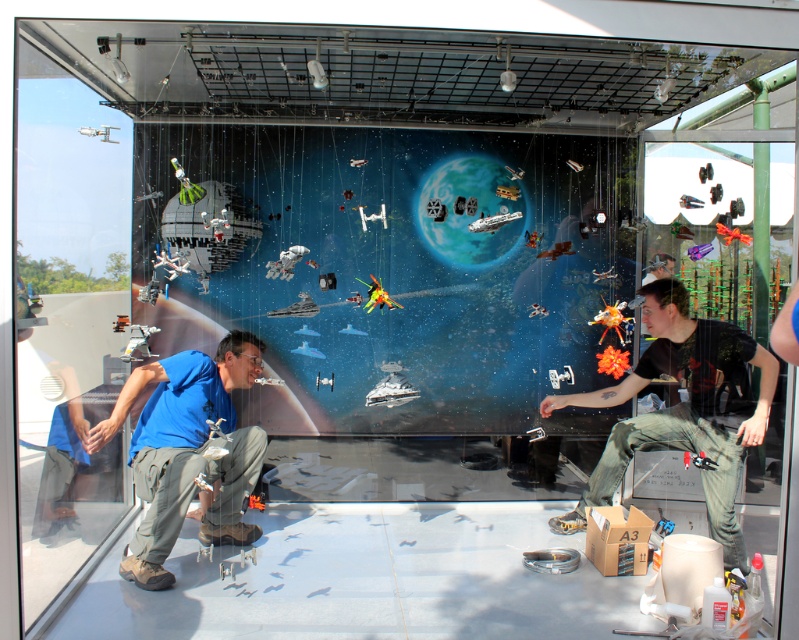
Question: Is transparent glass door at upper left thinner than blue fabric shirt at lower left?

Choices:
 (A) no
 (B) yes

Answer: (B)

Question: Does transparent glass door at upper left have a greater width compared to blue fabric shirt at lower left?

Choices:
 (A) no
 (B) yes

Answer: (A)

Question: Which of the following is the farthest from the observer?

Choices:
 (A) blue fabric shirt at lower left
 (B) dark green pants at right
 (C) transparent glass door at upper left

Answer: (B)

Question: From the image, what is the correct spatial relationship of blue fabric shirt at lower left in relation to dark green pants at right?

Choices:
 (A) below
 (B) above

Answer: (B)

Question: Which of these objects is positioned closest to the transparent glass door at upper left?

Choices:
 (A) dark green pants at right
 (B) blue fabric shirt at lower left

Answer: (B)

Question: Considering the real-world distances, which object is farthest from the transparent glass door at upper left?

Choices:
 (A) blue fabric shirt at lower left
 (B) dark green pants at right

Answer: (B)